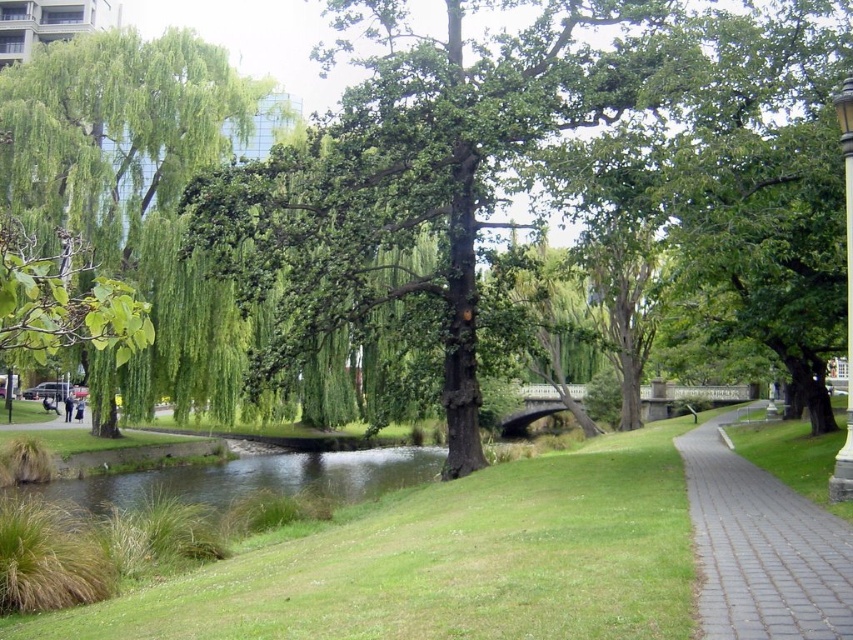
You are standing at the edge of the park pathway and want to reach a specific spot marked by point (102, 419) and another spot marked by point (798, 589). Which point is closer to you?

Point (102, 419) is closer to you because it is further to the viewer than point (798, 589).

You are planning to place a picnic blanket on the grass between the green leafy willow at upper left and the paved brick path at lower right. Which object is wider so that the blanket can be placed closer to it?

The green leafy willow at upper left might be wider than the paved brick path at lower right, so placing the picnic blanket closer to the green leafy willow at upper left would provide more space.